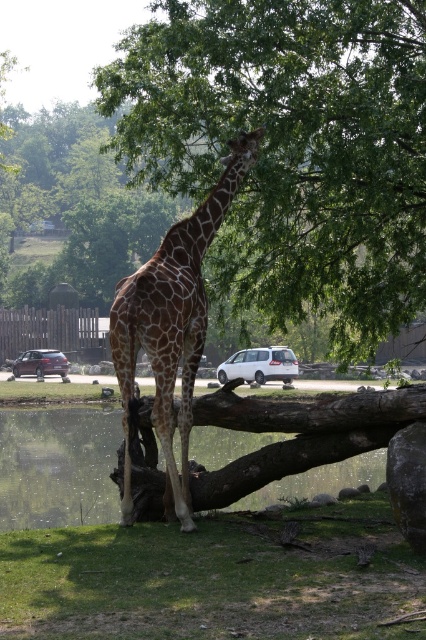
Question: Observing the image, what is the correct spatial positioning of green leafy tree at upper center in reference to green grass at lower center?

Choices:
 (A) right
 (B) left

Answer: (B)

Question: Which object appears farthest from the camera in this image?

Choices:
 (A) spotted fur giraffe at center
 (B) white matte van at center
 (C) green grass at lower center
 (D) brown rough tree trunk at center

Answer: (B)

Question: Is green grass at lower center behind matte black suv at center?

Choices:
 (A) no
 (B) yes

Answer: (A)

Question: Can you confirm if white matte van at center is wider than matte black suv at center?

Choices:
 (A) yes
 (B) no

Answer: (A)

Question: Which point is closer to the camera?

Choices:
 (A) (253, 360)
 (B) (282, 401)
 (C) (379, 145)
 (D) (28, 369)

Answer: (C)

Question: Which object is farther from the camera taking this photo?

Choices:
 (A) green grass at lower center
 (B) white matte van at center
 (C) spotted fur giraffe at center

Answer: (B)